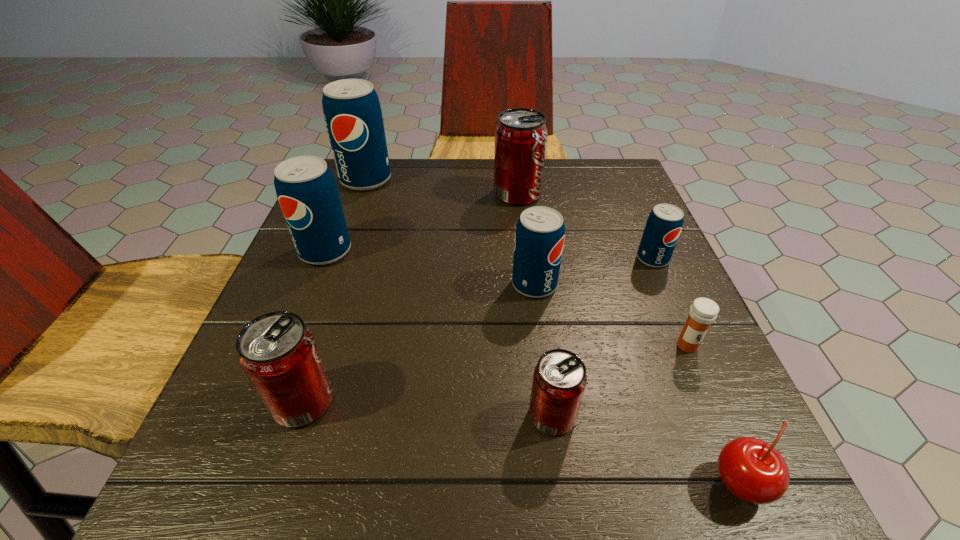
Identify the location of free space at the right edge. (661, 299).

Where is `vacant space at the far left corner of the desktop`? vacant space at the far left corner of the desktop is located at coordinates (392, 162).

Identify the location of free spot at the near left corner of the desktop. The width and height of the screenshot is (960, 540). (305, 490).

Identify the location of vacant position at the far right corner of the desktop. The image size is (960, 540). (610, 173).

You are a GUI agent. You are given a task and a screenshot of the screen. Output one action in this format:
    pyautogui.click(x=<x>, y=<y>)
    Task: Click on the free spot between the second biggest blue pop and the second blue pop from right to left
    The width and height of the screenshot is (960, 540).
    Given the screenshot: What is the action you would take?
    pyautogui.click(x=430, y=268)

This screenshot has height=540, width=960. I want to click on free space between the biggest blue pop and the nearest object, so click(x=553, y=332).

You are a GUI agent. You are given a task and a screenshot of the screen. Output one action in this format:
    pyautogui.click(x=<x>, y=<y>)
    Task: Click on the free space between the medicine and the fifth farthest pop soda
    This screenshot has width=960, height=540.
    Given the screenshot: What is the action you would take?
    pyautogui.click(x=611, y=315)

Where is `empty space between the farthest blue pop and the leftmost red pop soda`? empty space between the farthest blue pop and the leftmost red pop soda is located at coordinates (334, 291).

Find the location of a particular element. free space between the farthest blue pop and the fifth nearest object is located at coordinates (450, 232).

Where is `free space between the second biggest blue pop and the sixth farthest object`? free space between the second biggest blue pop and the sixth farthest object is located at coordinates (506, 298).